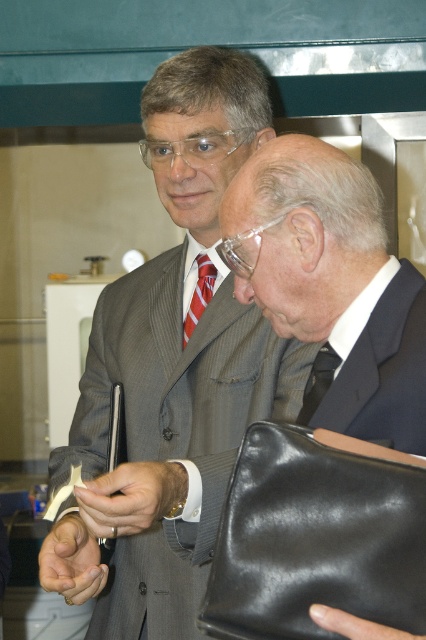
In the scene described, there are two men facing each other. The man on the left is wearing a gray suit and holding a pen, while the man on the right is in a dark blue suit holding a folder. Both are wearing glasses and have gray hair. Now, you notice an object labeled as the matte gray suit at center and the matte black wristwatch at center. Based on their positions, which object is located to the right of the other?

The matte gray suit at center is to the right of the matte black wristwatch at center.

You are an event photographer who needs to capture a closeup of both the smooth skin hand at center and the dark blue silk tie at center in the image. Based on their positions, which one is located to the left?

The smooth skin hand at center is positioned on the left side of the dark blue silk tie at center, so the smooth skin hand at center is located to the left.